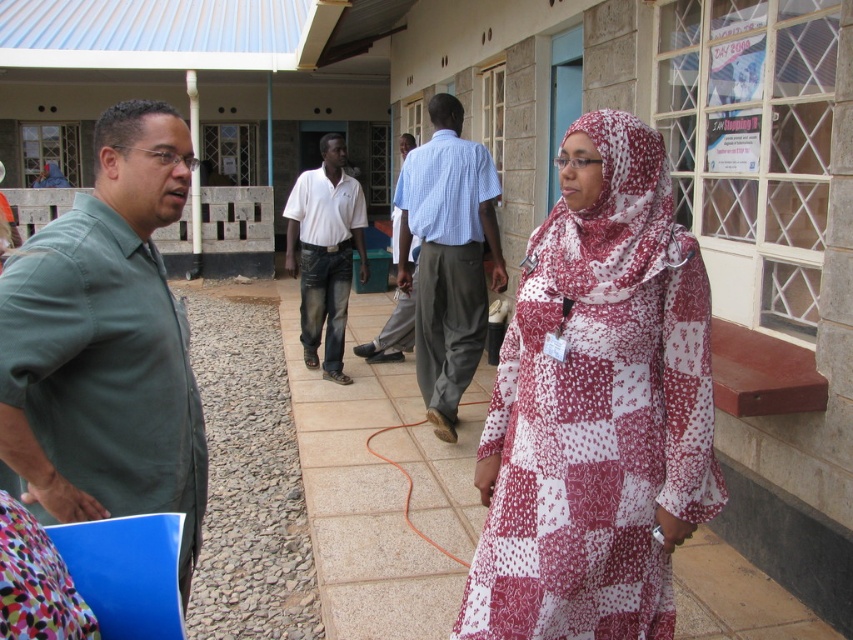
Is green cotton shirt at left further to the viewer compared to light blue checkered shirt at center?

No, green cotton shirt at left is closer to the viewer.

Between point (109, 228) and point (445, 120), which one is positioned behind?

The point (445, 120) is more distant.

You are a GUI agent. You are given a task and a screenshot of the screen. Output one action in this format:
    pyautogui.click(x=<x>, y=<y>)
    Task: Click on the green cotton shirt at left
    
    Given the screenshot: What is the action you would take?
    pyautogui.click(x=106, y=342)

You are a GUI agent. You are given a task and a screenshot of the screen. Output one action in this format:
    pyautogui.click(x=<x>, y=<y>)
    Task: Click on the green cotton shirt at left
    The image size is (853, 640).
    Given the screenshot: What is the action you would take?
    pyautogui.click(x=106, y=342)

Is green cotton shirt at left further to camera compared to white cotton shirt at center?

No, green cotton shirt at left is in front of white cotton shirt at center.

What do you see at coordinates (106, 342) in the screenshot? I see `green cotton shirt at left` at bounding box center [106, 342].

In order to click on green cotton shirt at left in this screenshot , I will do pos(106,342).

At what (x,y) coordinates should I click in order to perform the action: click on green cotton shirt at left. Please return your answer as a coordinate pair (x, y). The height and width of the screenshot is (640, 853). Looking at the image, I should click on (106, 342).

Can you confirm if green cotton shirt at left is taller than light blue striped shirt at center?

Yes, green cotton shirt at left is taller than light blue striped shirt at center.

Does point (160, 148) come behind point (412, 273)?

That is False.

Locate an element on the screen. This screenshot has width=853, height=640. green cotton shirt at left is located at coordinates (106, 342).